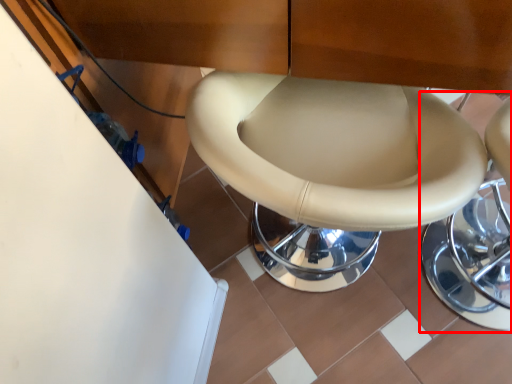
Question: In this image, where is bar stool (annotated by the red box) located relative to toilet?

Choices:
 (A) left
 (B) right

Answer: (B)